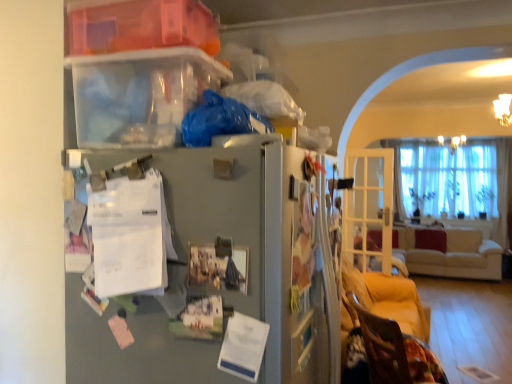
Question: Considering the positions of metallic gray fridge at center and beige fabric couch at right in the image, is metallic gray fridge at center wider or thinner than beige fabric couch at right?

Choices:
 (A) wide
 (B) thin

Answer: (B)

Question: From a real-world perspective, is metallic gray fridge at center above or below beige fabric couch at right?

Choices:
 (A) below
 (B) above

Answer: (B)

Question: Estimate the real-world distances between objects in this image. Which object is closer to the beige fabric couch at right?

Choices:
 (A) clear glass door at right
 (B) velvet brown armchair at lower right
 (C) metallic gray fridge at center
 (D) translucent plastic storage box at upper left

Answer: (A)

Question: Considering the real-world distances, which object is closest to the beige fabric couch at right?

Choices:
 (A) velvet brown armchair at lower right
 (B) metallic gray fridge at center
 (C) translucent plastic storage box at upper left
 (D) clear glass door at right

Answer: (D)